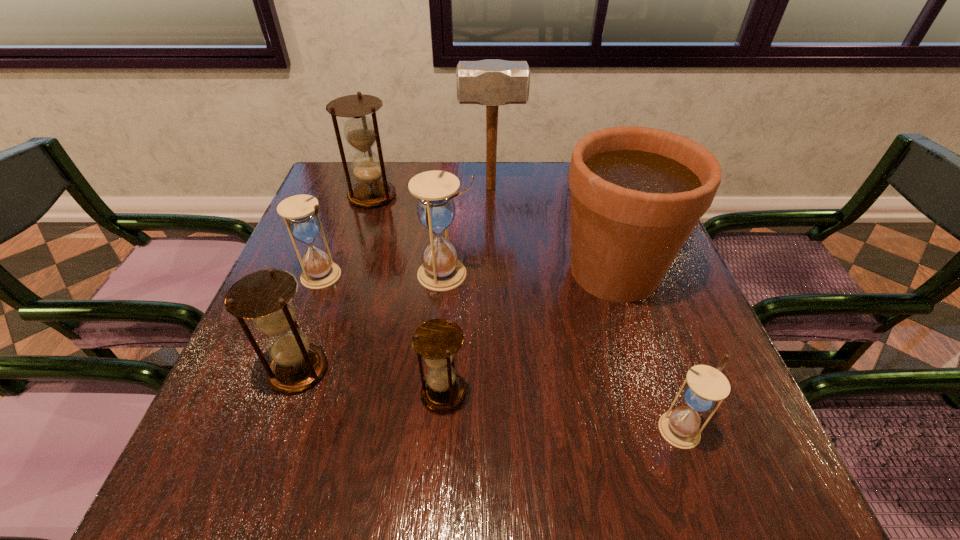
Find the location of a particular element. This screenshot has width=960, height=540. mallet that is at the far edge is located at coordinates (492, 83).

Locate an element on the screen. The image size is (960, 540). hourglass situated at the far edge is located at coordinates (361, 132).

Identify the location of object that is at the near edge. (706, 386).

Where is `flowerpot present at the right edge`? This screenshot has width=960, height=540. flowerpot present at the right edge is located at coordinates (637, 193).

I want to click on hourglass at the right edge, so click(706, 386).

This screenshot has width=960, height=540. In order to click on object positioned at the far left corner in this screenshot , I will do `click(361, 132)`.

Identify the location of object present at the near right corner. The height and width of the screenshot is (540, 960). (706, 386).

In the image, there is a desktop. Identify the location of vacant space at the far edge. This screenshot has width=960, height=540. (453, 171).

In the image, there is a desktop. Where is `vacant region at the near edge`? This screenshot has height=540, width=960. vacant region at the near edge is located at coordinates (519, 477).

The image size is (960, 540). In the image, there is a desktop. Find the location of `vacant space at the left edge`. vacant space at the left edge is located at coordinates (293, 418).